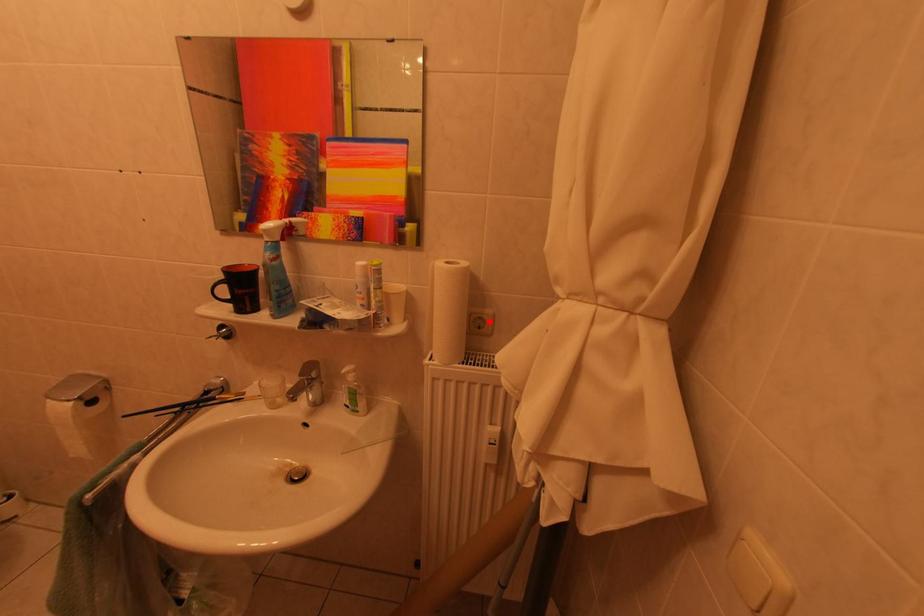
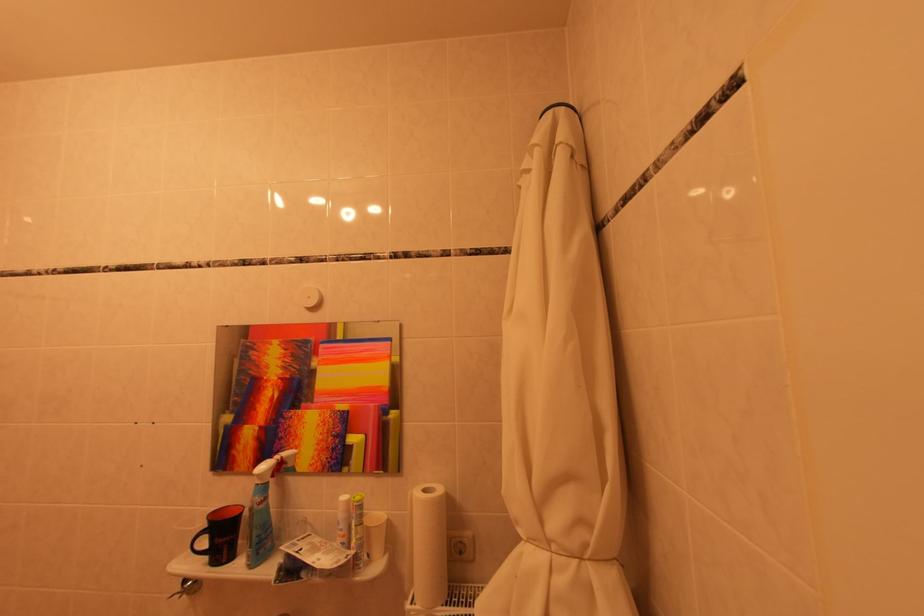
Where in the second image is the point corresponding to the highlighted location from the first image?

(468, 546)